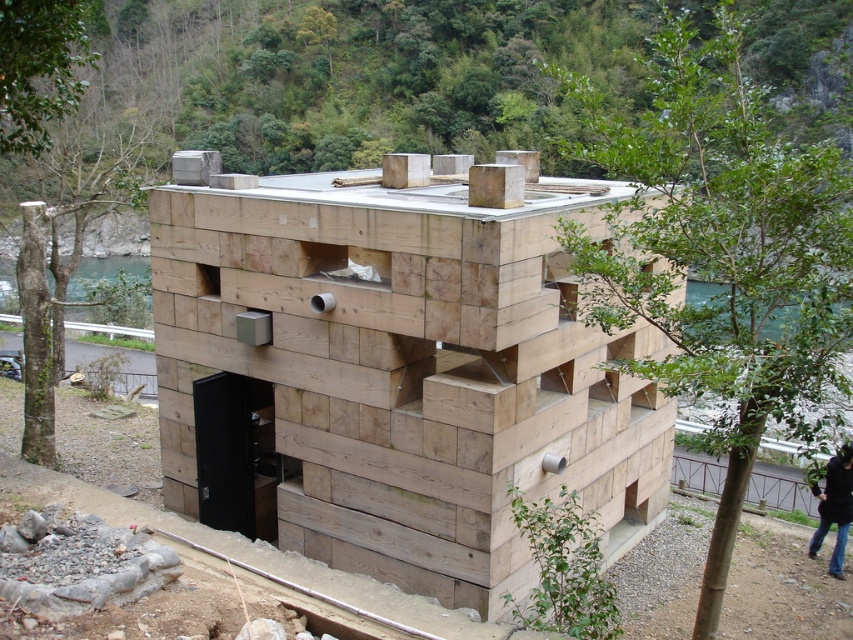
Which of these two, natural wood house at center or jeans at lower right, stands shorter?

jeans at lower right is shorter.

Is natural wood house at center taller than jeans at lower right?

Correct, natural wood house at center is much taller as jeans at lower right.

Which is behind, point (349, 324) or point (828, 570)?

The point (828, 570) is behind.

This screenshot has width=853, height=640. What are the coordinates of `natural wood house at center` in the screenshot? It's located at (405, 369).